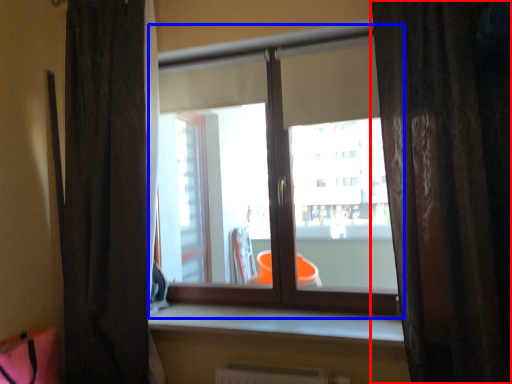
Question: Which point is further to the camera, curtain (highlighted by a red box) or window (highlighted by a blue box)?

Choices:
 (A) curtain
 (B) window

Answer: (B)